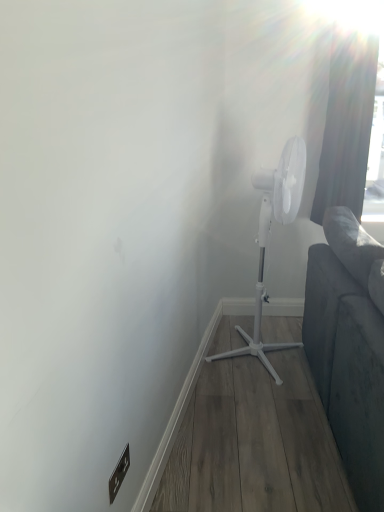
This screenshot has height=512, width=384. I want to click on brown matte electric outlet at lower left, so click(119, 474).

This screenshot has width=384, height=512. I want to click on dark gray fabric curtain at upper right, so click(x=347, y=125).

From the image's perspective, is brown matte electric outlet at lower left located beneath white plastic mechanical fan at center?

Yes, from the image's perspective, brown matte electric outlet at lower left is below white plastic mechanical fan at center.

Is white plastic mechanical fan at center at the back of brown matte electric outlet at lower left?

No, brown matte electric outlet at lower left's orientation is not away from white plastic mechanical fan at center.

Does point (110, 478) come in front of point (224, 355)?

Yes, it is in front of point (224, 355).

Measure the distance between brown matte electric outlet at lower left and white plastic mechanical fan at center.

4.62 feet.

Between white plastic mechanical fan at center and brown matte electric outlet at lower left, which one has smaller size?

With smaller size is brown matte electric outlet at lower left.

Between white plastic mechanical fan at center and brown matte electric outlet at lower left, which one has less height?

Standing shorter between the two is brown matte electric outlet at lower left.

Would you say white plastic mechanical fan at center is a long distance from brown matte electric outlet at lower left?

Yes, white plastic mechanical fan at center and brown matte electric outlet at lower left are quite far apart.

From a real-world perspective, is white plastic mechanical fan at center positioned under brown matte electric outlet at lower left based on gravity?

No, from a real-world perspective, white plastic mechanical fan at center is not under brown matte electric outlet at lower left.

Is white plastic mechanical fan at center next to dark gray fabric curtain at upper right and touching it?

There is a gap between white plastic mechanical fan at center and dark gray fabric curtain at upper right.

Looking at the image, does white plastic mechanical fan at center seem bigger or smaller compared to dark gray fabric curtain at upper right?

white plastic mechanical fan at center is bigger than dark gray fabric curtain at upper right.

Is dark gray fabric curtain at upper right inside white plastic mechanical fan at center?

No, dark gray fabric curtain at upper right is not a part of white plastic mechanical fan at center.

Which of these two, white plastic mechanical fan at center or dark gray fabric curtain at upper right, stands shorter?

dark gray fabric curtain at upper right is shorter.

Is point (322, 144) positioned after point (269, 204)?

That is True.

Where is `mechanical fan on the left of dark gray fabric curtain at upper right`? mechanical fan on the left of dark gray fabric curtain at upper right is located at coordinates (267, 237).

Does dark gray fabric curtain at upper right have a lesser width compared to white plastic mechanical fan at center?

Indeed, dark gray fabric curtain at upper right has a lesser width compared to white plastic mechanical fan at center.

What's the angular difference between dark gray fabric curtain at upper right and white plastic mechanical fan at center's facing directions?

They differ by 69.6 degrees in their facing directions.

Consider the image. Is dark gray fabric curtain at upper right at the back of brown matte electric outlet at lower left?

No, dark gray fabric curtain at upper right is not at the back of brown matte electric outlet at lower left.

What's the angular difference between brown matte electric outlet at lower left and dark gray fabric curtain at upper right's facing directions?

80 degrees.

Based on their sizes in the image, would you say brown matte electric outlet at lower left is bigger or smaller than dark gray fabric curtain at upper right?

Considering their sizes, brown matte electric outlet at lower left takes up less space than dark gray fabric curtain at upper right.

Considering the relative positions of brown matte electric outlet at lower left and dark gray fabric curtain at upper right in the image provided, is brown matte electric outlet at lower left to the left or to the right of dark gray fabric curtain at upper right?

brown matte electric outlet at lower left is positioned on dark gray fabric curtain at upper right's left side.

Considering the sizes of objects dark gray fabric curtain at upper right and brown matte electric outlet at lower left in the image provided, who is bigger, dark gray fabric curtain at upper right or brown matte electric outlet at lower left?

Bigger between the two is dark gray fabric curtain at upper right.

Is point (341, 170) closer or farther from the camera than point (111, 492)?

Clearly, point (341, 170) is more distant from the camera than point (111, 492).

From the picture: Does dark gray fabric curtain at upper right have a lesser height compared to brown matte electric outlet at lower left?

No, dark gray fabric curtain at upper right is not shorter than brown matte electric outlet at lower left.

Find the location of `mechanical fan above the brown matte electric outlet at lower left (from a real-world perspective)`. mechanical fan above the brown matte electric outlet at lower left (from a real-world perspective) is located at coordinates (267, 237).

I want to click on mechanical fan lying on the right of brown matte electric outlet at lower left, so click(x=267, y=237).

From the picture: Considering their positions, is brown matte electric outlet at lower left positioned further to dark gray fabric curtain at upper right than white plastic mechanical fan at center?

Among the two, brown matte electric outlet at lower left is located further to dark gray fabric curtain at upper right.

From the image, which object appears to be farther from dark gray fabric curtain at upper right, white plastic mechanical fan at center or brown matte electric outlet at lower left?

brown matte electric outlet at lower left lies further to dark gray fabric curtain at upper right than the other object.

Estimate the real-world distances between objects in this image. Which object is closer to white plastic mechanical fan at center, brown matte electric outlet at lower left or dark gray fabric curtain at upper right?

dark gray fabric curtain at upper right.

When comparing their distances from brown matte electric outlet at lower left, does dark gray fabric curtain at upper right or white plastic mechanical fan at center seem further?

Based on the image, dark gray fabric curtain at upper right appears to be further to brown matte electric outlet at lower left.

When comparing their distances from white plastic mechanical fan at center, does dark gray fabric curtain at upper right or brown matte electric outlet at lower left seem closer?

dark gray fabric curtain at upper right.

When comparing their distances from brown matte electric outlet at lower left, does white plastic mechanical fan at center or dark gray fabric curtain at upper right seem closer?

The object closer to brown matte electric outlet at lower left is white plastic mechanical fan at center.

The height and width of the screenshot is (512, 384). I want to click on mechanical fan between dark gray fabric curtain at upper right and brown matte electric outlet at lower left vertically, so click(x=267, y=237).